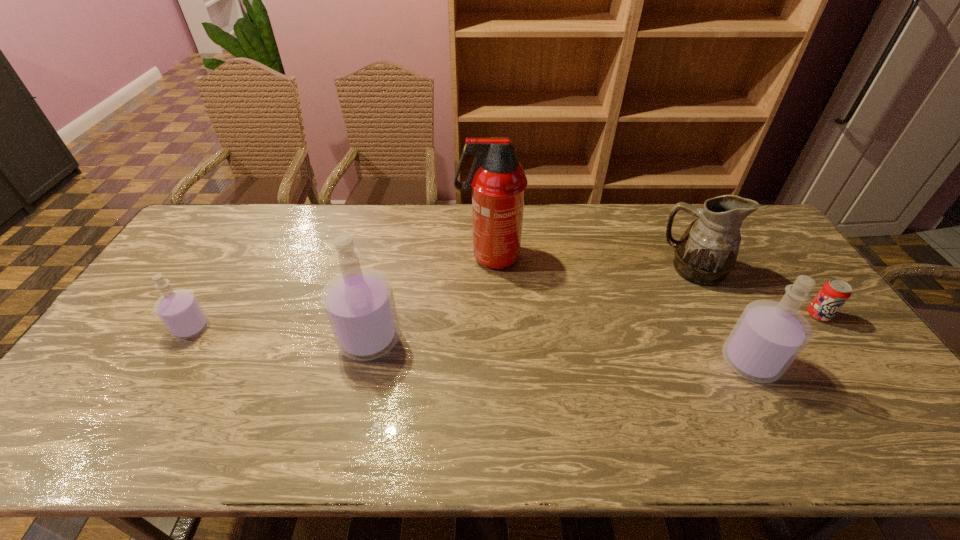
Please point a location where one more perfume can be added evenly. Please provide its 2D coordinates. Your answer should be formatted as a tuple, i.e. [(x, y)], where the tuple contains the x and y coordinates of a point satisfying the conditions above.

[(556, 350)]